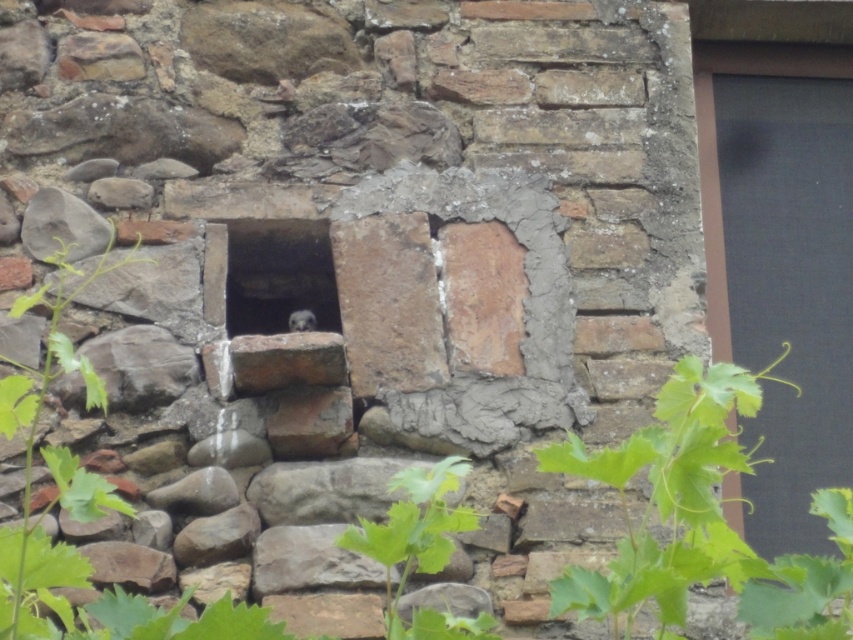
Question: In this image, where is matte black window at right located relative to smooth stone hole at center?

Choices:
 (A) left
 (B) right

Answer: (B)

Question: Which of the following is the farthest from the observer?

Choices:
 (A) smooth stone hole at center
 (B) matte black window at right

Answer: (A)

Question: Does matte black window at right have a larger size compared to smooth stone hole at center?

Choices:
 (A) no
 (B) yes

Answer: (B)

Question: Is matte black window at right wider than smooth stone hole at center?

Choices:
 (A) yes
 (B) no

Answer: (A)